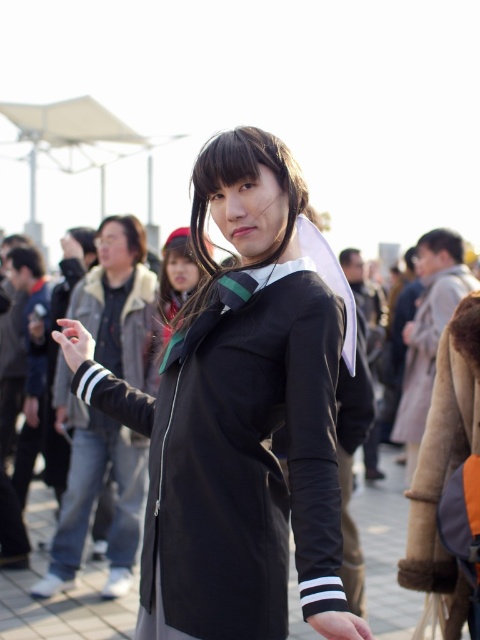
You are a fashion designer observing an outdoor event. You notice two jackets in the crowd. The beige fur coat at right and the black matte jacket at center. Which jacket appears taller when viewed from the front?

The beige fur coat at right appears taller than the black matte jacket at center because it has a greater height compared to the black matte jacket at center.

You are standing in the scene and want to move from the point closer to you to the farther point. Which path would you take between the two points, point (x=432, y=524) and point (x=62, y=403)?

You should move from point (x=432, y=524) to point (x=62, y=403) since point (x=432, y=524) is closer to the viewer and the other is farther away.